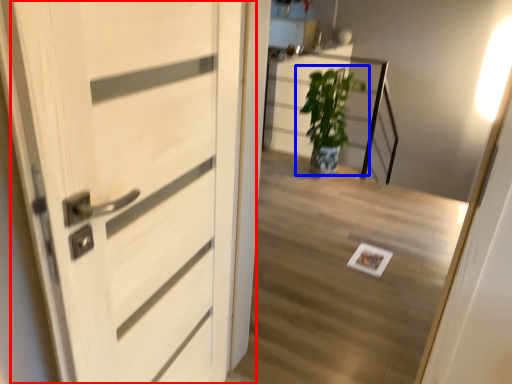
Question: Which object is closer to the camera taking this photo, door (highlighted by a red box) or houseplant (highlighted by a blue box)?

Choices:
 (A) door
 (B) houseplant

Answer: (A)